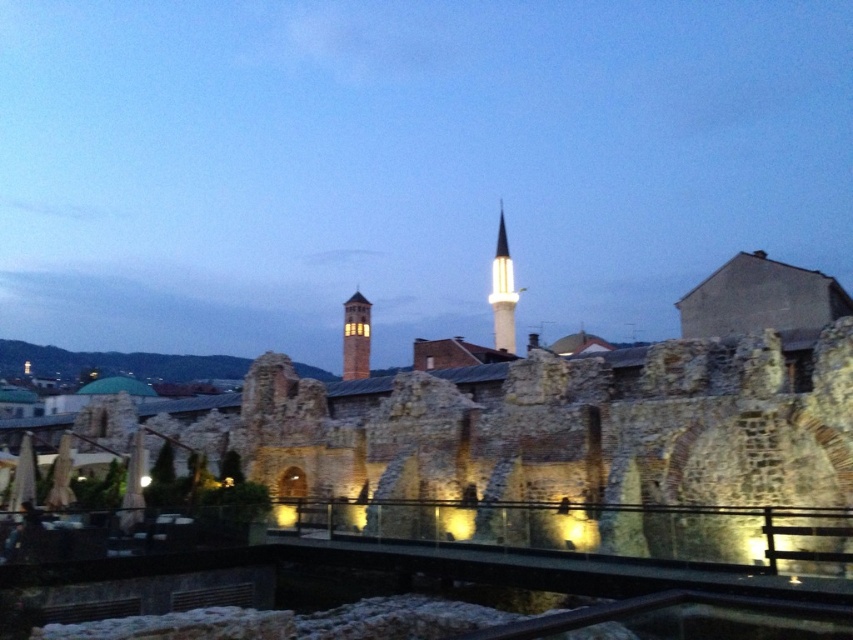
Question: Is white marble minaret at center positioned before matte brick tower at center?

Choices:
 (A) no
 (B) yes

Answer: (B)

Question: Can you confirm if white marble minaret at center is positioned above matte brick tower at center?

Choices:
 (A) no
 (B) yes

Answer: (B)

Question: Does white marble minaret at center have a larger size compared to matte brick tower at center?

Choices:
 (A) yes
 (B) no

Answer: (A)